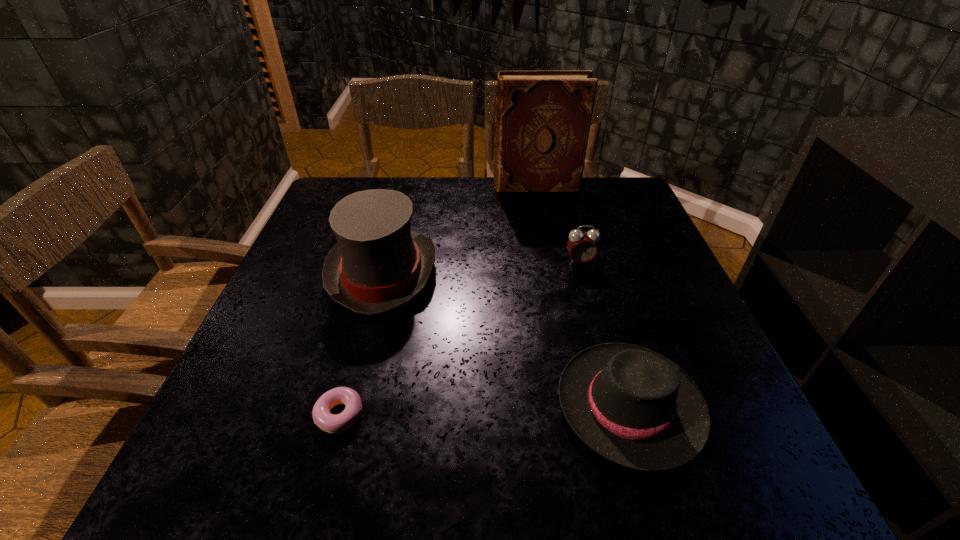
Where is `object at the far right corner`? object at the far right corner is located at coordinates (543, 119).

Where is `object located in the near right corner section of the desktop`? object located in the near right corner section of the desktop is located at coordinates (633, 406).

You are a GUI agent. You are given a task and a screenshot of the screen. Output one action in this format:
    pyautogui.click(x=<x>, y=<y>)
    Task: Click on the free region at the far edge of the desktop
    The image size is (960, 540).
    Given the screenshot: What is the action you would take?
    pyautogui.click(x=445, y=201)

Identify the location of vacant space at the left edge of the desktop. (281, 323).

Where is `vacant space at the right edge of the desktop`? Image resolution: width=960 pixels, height=540 pixels. vacant space at the right edge of the desktop is located at coordinates (701, 383).

This screenshot has width=960, height=540. What are the coordinates of `free space at the far left corner of the desktop` in the screenshot? It's located at (334, 178).

Identify the location of vacant space at the near left corner of the desktop. This screenshot has width=960, height=540. (245, 486).

The width and height of the screenshot is (960, 540). In order to click on blank area at the far right corner in this screenshot , I will do `click(624, 218)`.

I want to click on vacant area that lies between the shortest object and the tallest object, so click(x=438, y=301).

Where is `empty space between the doughnut and the farther dress hat`? empty space between the doughnut and the farther dress hat is located at coordinates (361, 344).